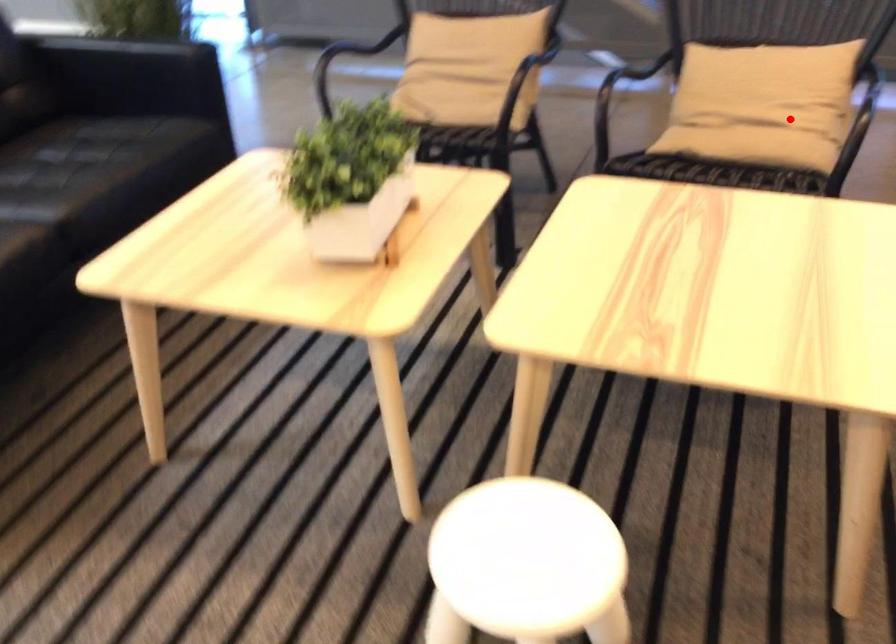
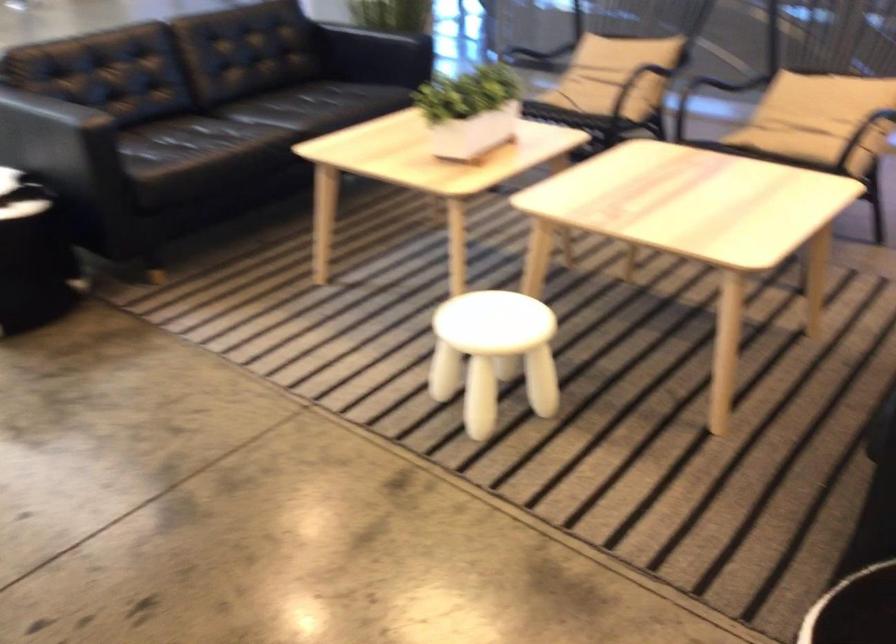
In the second image, find the point that corresponds to the highlighted location in the first image.

(817, 118)